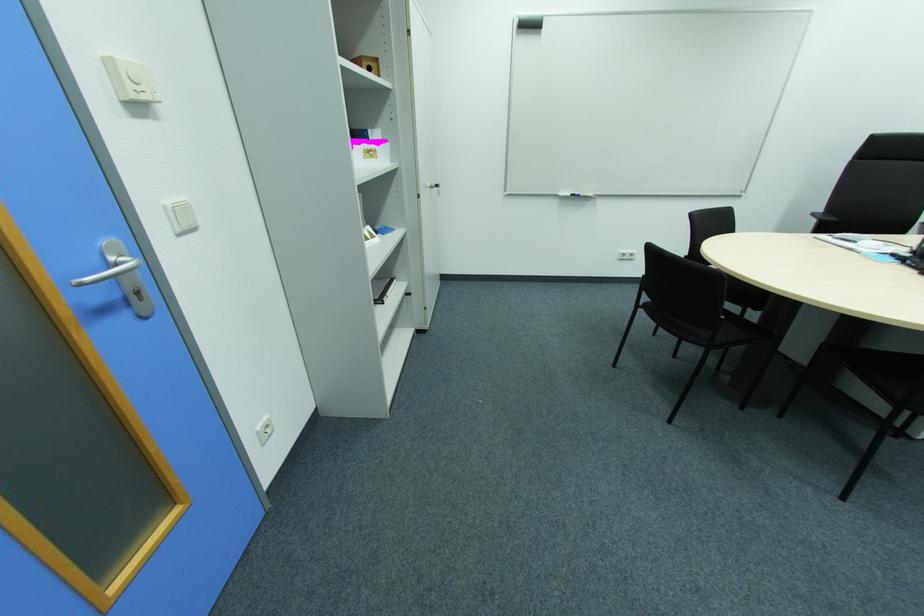
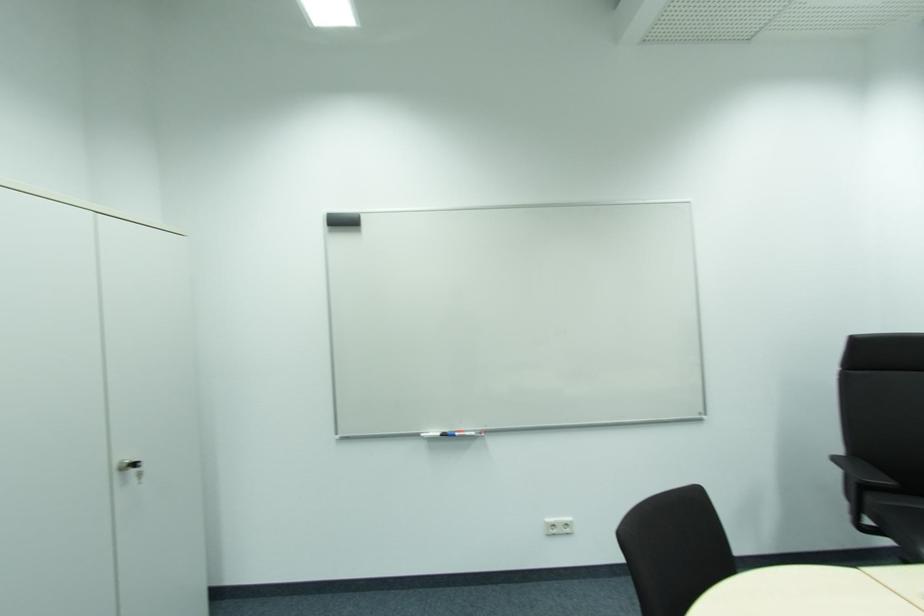
Where in the second image is the point corresponding to point 444,185 from the first image?

(140, 464)